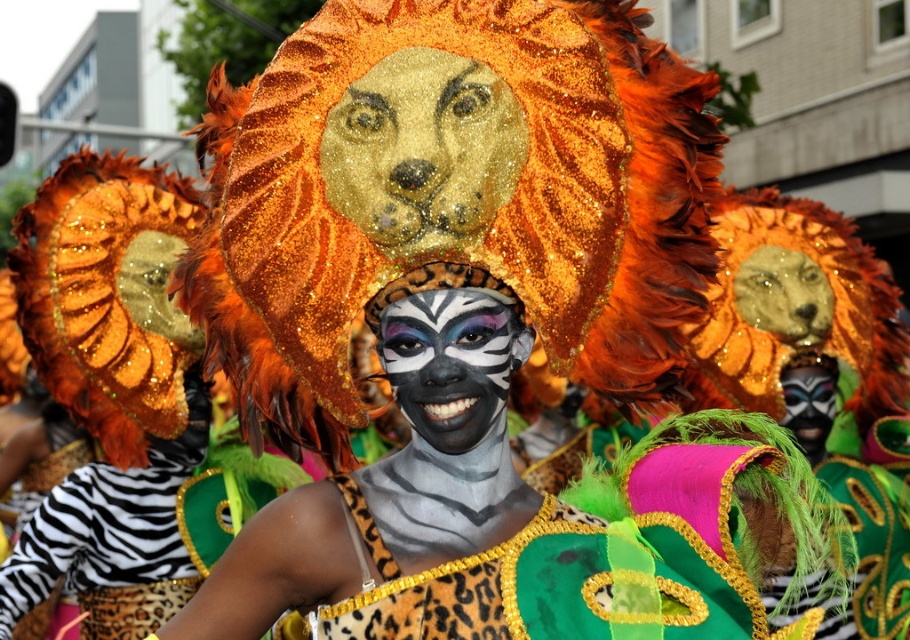
This screenshot has height=640, width=910. What are the coordinates of `gold glittery lion head at center` in the screenshot? It's located at (423, 150).

Which of these two, gold glittery lion head at center or zebra-striped face paint at center, stands taller?

Standing taller between the two is gold glittery lion head at center.

Between point (372, 221) and point (433, 289), which one is positioned in front?

Positioned in front is point (372, 221).

You are a GUI agent. You are given a task and a screenshot of the screen. Output one action in this format:
    pyautogui.click(x=<x>, y=<y>)
    Task: Click on the gold glittery lion head at center
    
    Given the screenshot: What is the action you would take?
    pyautogui.click(x=423, y=150)

Does zebra-striped face paint at center appear on the right side of matte black mask at center?

In fact, zebra-striped face paint at center is to the left of matte black mask at center.

This screenshot has height=640, width=910. What are the coordinates of `zebra-striped face paint at center` in the screenshot? It's located at (451, 360).

What do you see at coordinates (451, 360) in the screenshot?
I see `zebra-striped face paint at center` at bounding box center [451, 360].

The image size is (910, 640). In order to click on zebra-striped face paint at center in this screenshot , I will do `click(451, 360)`.

Who is lower down, gold glittery lion head at center or matte black mask at center?

Positioned lower is matte black mask at center.

Locate an element on the screen. gold glittery lion head at center is located at coordinates (423, 150).